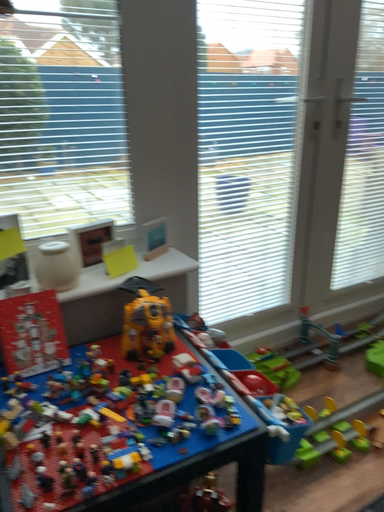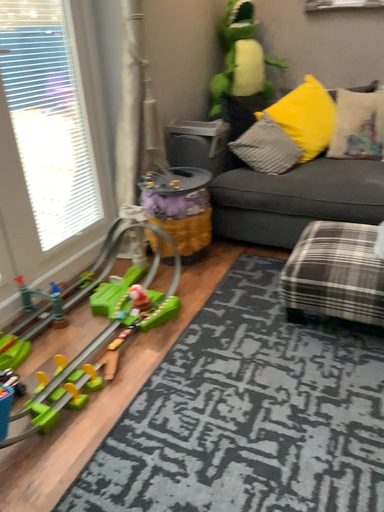
Question: How did the camera likely rotate when shooting the video?

Choices:
 (A) rotated right
 (B) rotated left

Answer: (A)